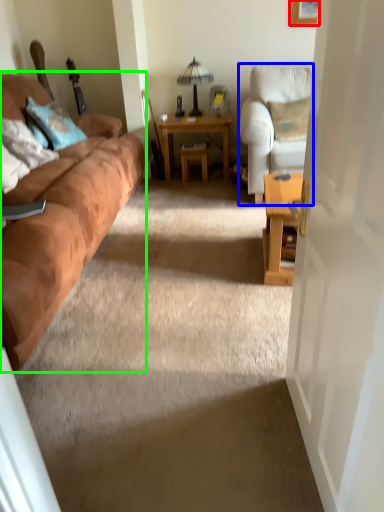
Question: Which object is the farthest from picture frame (highlighted by a red box)? Choose among these: chair (highlighted by a blue box) or studio couch (highlighted by a green box).

Choices:
 (A) chair
 (B) studio couch

Answer: (B)